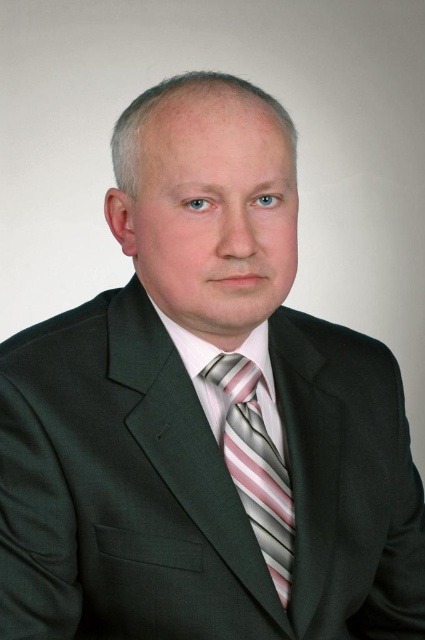
You are a photographer adjusting the focus on a camera. You notice the striped silk tie at center and the pink striped dress shirt at center in the frame. Which object should you focus on first to ensure the closer one is sharp?

The striped silk tie at center is closer to the viewer, so you should focus on it first to ensure it is sharp before adjusting focus to the pink striped dress shirt at center.